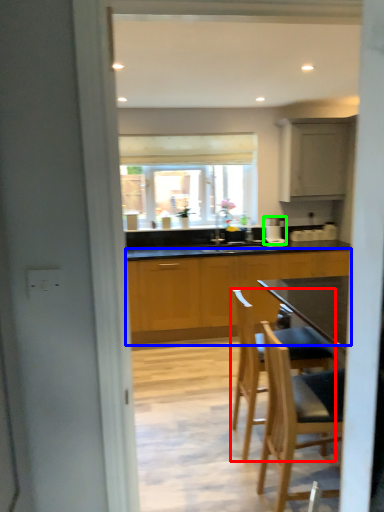
Question: Considering the real-world distances, which object is closest to chair (highlighted by a red box)? cabinetry (highlighted by a blue box) or coffee machine (highlighted by a green box).

Choices:
 (A) cabinetry
 (B) coffee machine

Answer: (A)